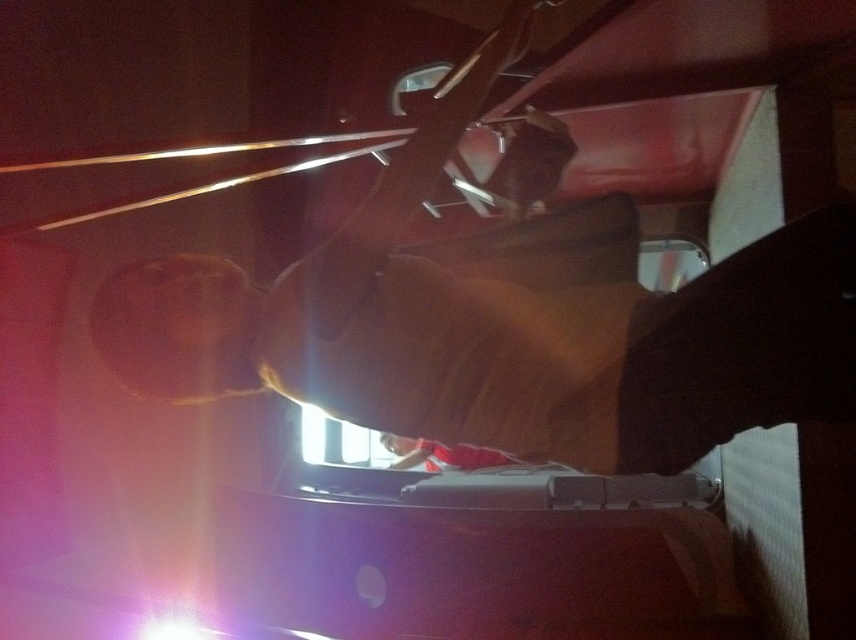
You are a passenger on a train and you want to put your brown leather jacket at center into an overhead compartment. Based on the scene description, can you determine if the jacket will fit inside the overhead compartment?

The brown leather jacket at center is located at point (520, 342), but the exact dimensions of the overhead compartment are not provided. Therefore, it is impossible to determine if the jacket will fit inside the overhead compartment based on the given information.

You are a passenger in a vehicle and see a brown leather jacket at center and a red fabric at center. Which item is placed on top of the other?

The brown leather jacket at center is positioned over red fabric at center.

You are a passenger sitting in the vehicle and you see the brown leather jacket at center and the red fabric at center. Which one is positioned more to the right side of the vehicle?

The brown leather jacket at center is positioned to the right of the red fabric at center, so the brown leather jacket at center is more to the right side of the vehicle.